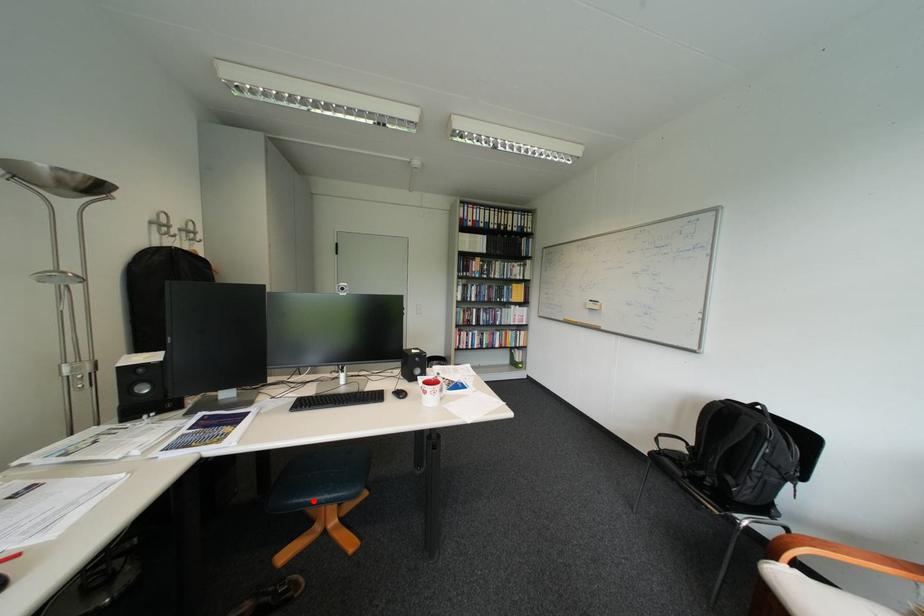
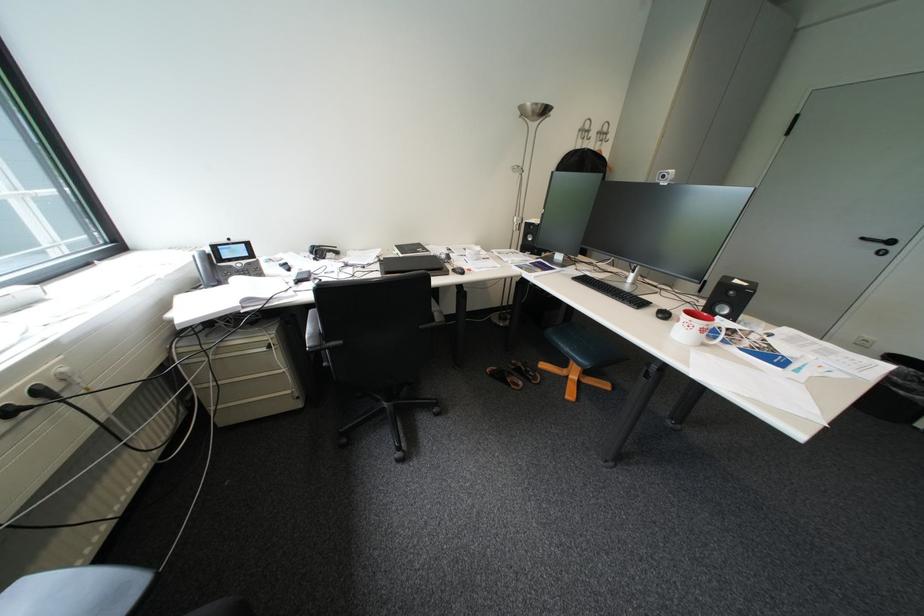
Question: I am providing you with two images of the same scene from different viewpoints. Given a red point in image1, look at the same physical point in image2. Is it:

Choices:
 (A) Closer to the viewpoint
 (B) Farther from the viewpoint

Answer: (A)